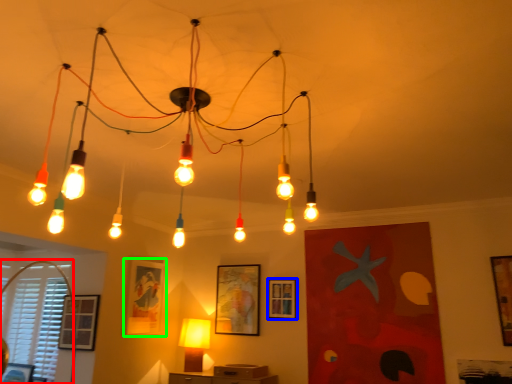
Question: Which object is the farthest from window (highlighted by a red box)? Choose among these: picture frame (highlighted by a blue box) or picture frame (highlighted by a green box).

Choices:
 (A) picture frame
 (B) picture frame

Answer: (A)